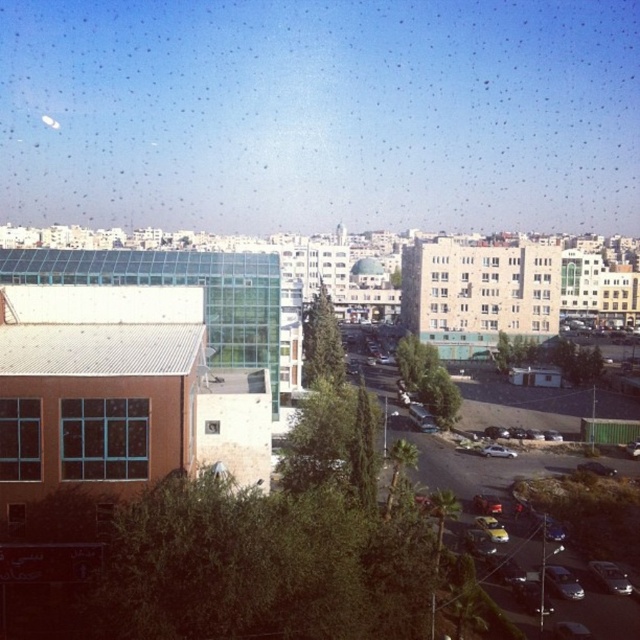
You are a delivery driver who needs to park your vehicle in a space that can only accommodate cars up to 1.8 meters in width. You see a satin silver sedan at lower right and a shiny silver car at lower right in the parking area. Which car should you avoid parking next to to ensure there is enough space?

You should avoid parking next to the satin silver sedan at lower right because its width is larger than the shiny silver car at lower right, making it less likely to fit in the 1.8 meter space.

You are a pedestrian standing at the edge of the road. You see a metallic silver sedan at center and a silver metallic car at lower right. Which car is closer to you?

The metallic silver sedan at center is closer to you because it is positioned in front of the silver metallic car at lower right.